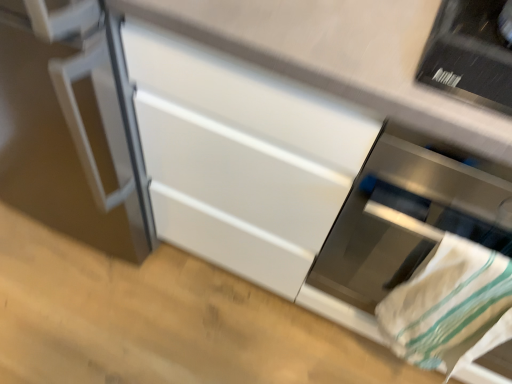
Question: From the image's perspective, is stainless steel oven at lower right positioned above or below white cotton towel at lower right?

Choices:
 (A) below
 (B) above

Answer: (B)

Question: In terms of height, does stainless steel oven at lower right look taller or shorter compared to white cotton towel at lower right?

Choices:
 (A) tall
 (B) short

Answer: (A)

Question: From a real-world perspective, is stainless steel oven at lower right physically located above or below white cotton towel at lower right?

Choices:
 (A) above
 (B) below

Answer: (A)

Question: Based on their sizes in the image, would you say white cotton towel at lower right is bigger or smaller than stainless steel oven at lower right?

Choices:
 (A) small
 (B) big

Answer: (A)

Question: From a real-world perspective, is white cotton towel at lower right above or below stainless steel oven at lower right?

Choices:
 (A) above
 (B) below

Answer: (B)

Question: Choose the correct answer: Is white cotton towel at lower right inside stainless steel oven at lower right or outside it?

Choices:
 (A) inside
 (B) outside

Answer: (A)

Question: In the image, is white cotton towel at lower right positioned in front of or behind stainless steel oven at lower right?

Choices:
 (A) front
 (B) behind

Answer: (B)